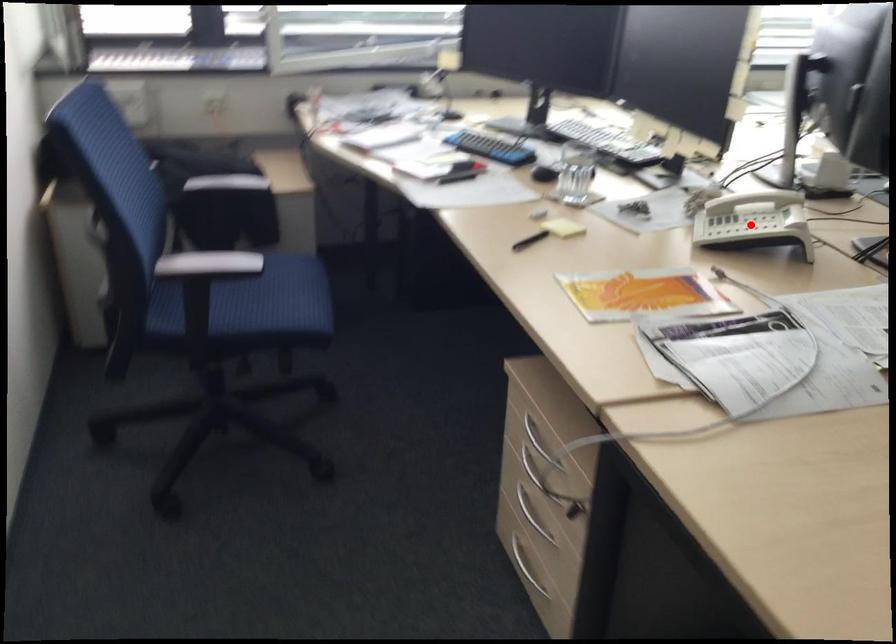
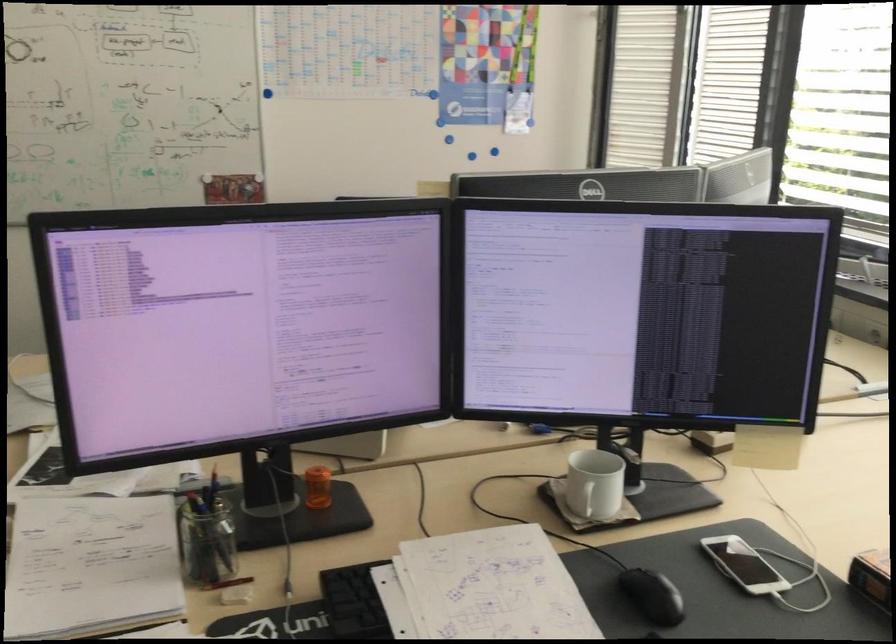
Question: I am providing you with two images of the same scene from different viewpoints. A red point is marked on the first image. At the location where the point appears in image 1, is it still visible in image 2?

Choices:
 (A) Yes
 (B) No

Answer: (B)